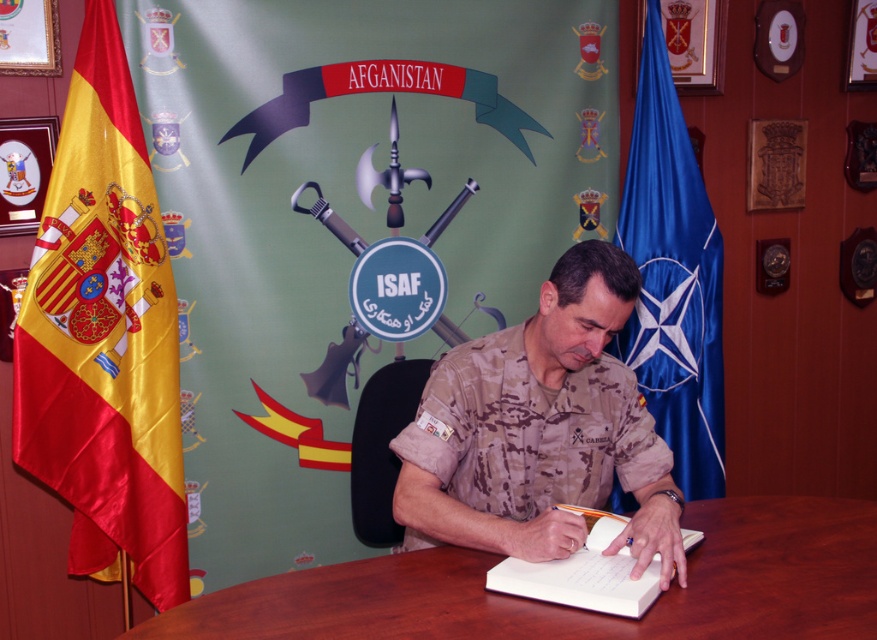
You are a photographer setting up for an official event. You notice the yellow satin flag at left and the camouflage uniform at center. Which object is closer to the camera?

The yellow satin flag at left is closer to the camera because it is positioned over the camouflage uniform at center.

You are a photographer positioned at the center of the room. You need to capture a photo that includes both the yellow satin flag at left and the AFGANISTAN banner. Which direction should you turn to ensure both are in frame?

To include both the yellow satin flag at left and the AFGANISTAN banner in the photo, you should turn to your left since the yellow satin flag at left is located at point (104, 336), which is to the left relative to the center position.

You are organizing a meeting in the described office. You need to place a 15 cm wide document on the brown wooden table at center. Can the white paper notebook at center currently occupying space on the table fit alongside the document without overlapping?

The brown wooden table at center might be wider than white paper notebook at center, so there is a possibility that the table has enough space to accommodate both the notebook and the 15 cm wide document without overlapping. However, the exact dimensions of the table and notebook are not provided, so this depends on their actual sizes.